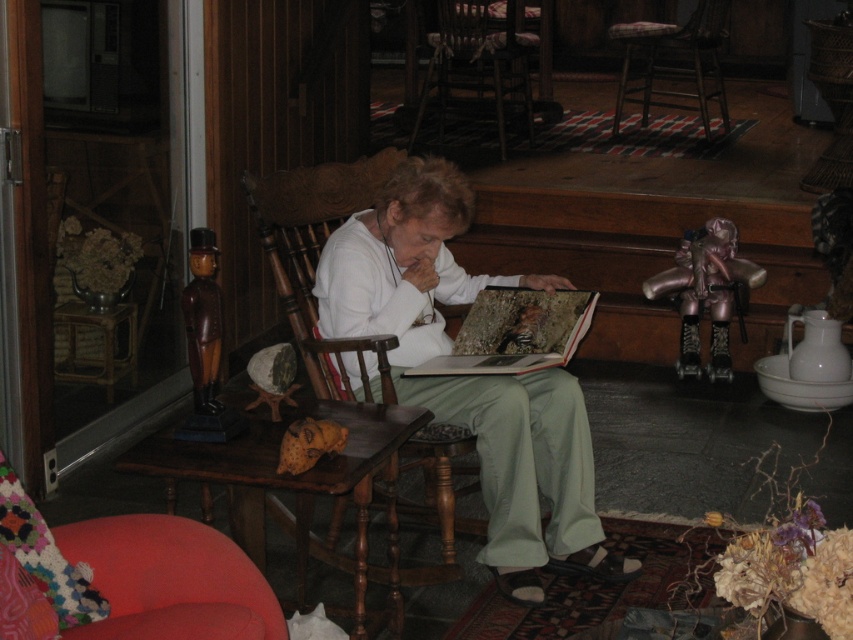
Is point (547, 429) farther from camera compared to point (692, 68)?

No, it is not.

Who is positioned more to the right, white matte sweater at center or plaid fabric cushioned stool at center?

From the viewer's perspective, plaid fabric cushioned stool at center appears more on the right side.

Describe the element at coordinates (469, 376) in the screenshot. I see `white matte sweater at center` at that location.

Identify the location of white matte sweater at center. The width and height of the screenshot is (853, 640). (469, 376).

Who is more forward, (485, 28) or (674, 285)?

Point (674, 285) is more forward.

Can you confirm if wooden chair at center is taller than metallic bronze doll at right?

Yes.

Is point (508, 56) positioned behind point (679, 358)?

That is True.

I want to click on wooden chair at center, so click(x=477, y=65).

Does white matte sweater at center have a greater width compared to metallic bronze doll at right?

Correct, the width of white matte sweater at center exceeds that of metallic bronze doll at right.

Is point (432, 307) closer to camera compared to point (743, 308)?

Yes, point (432, 307) is closer to viewer.

The width and height of the screenshot is (853, 640). In order to click on white matte sweater at center in this screenshot , I will do `click(469, 376)`.